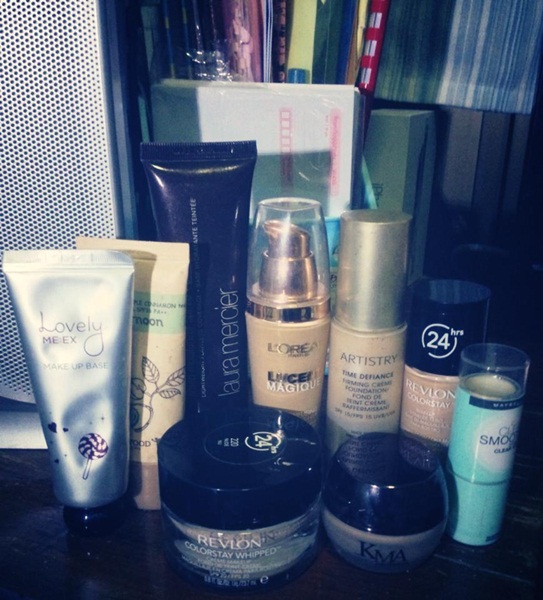
At what (x,y) coordinates should I click in order to perform the action: click on curtain. Please return your answer as a coordinate pair (x, y). This screenshot has width=543, height=600. Looking at the image, I should click on (473, 77).